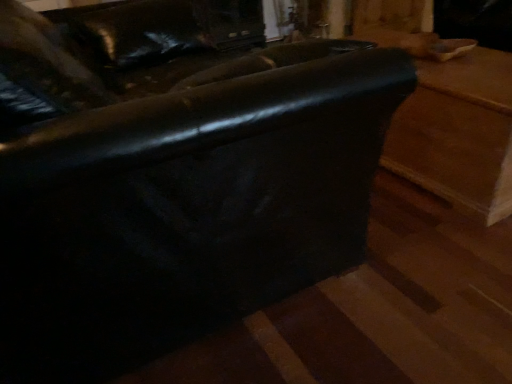
Where is `vacant space situated above wooden chest at right (from a real-world perspective)`? The height and width of the screenshot is (384, 512). vacant space situated above wooden chest at right (from a real-world perspective) is located at coordinates (461, 64).